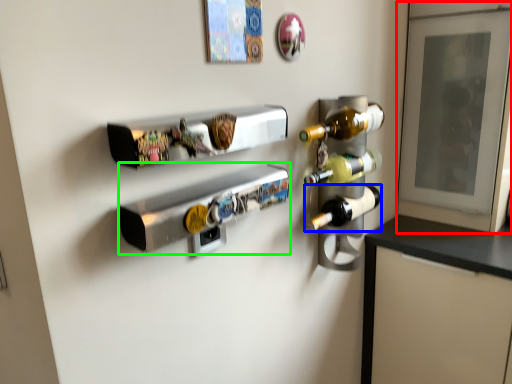
Question: Based on their relative distances, which object is nearer to glass door (highlighted by a red box)? Choose from bottle (highlighted by a blue box) and appliance (highlighted by a green box).

Choices:
 (A) bottle
 (B) appliance

Answer: (A)